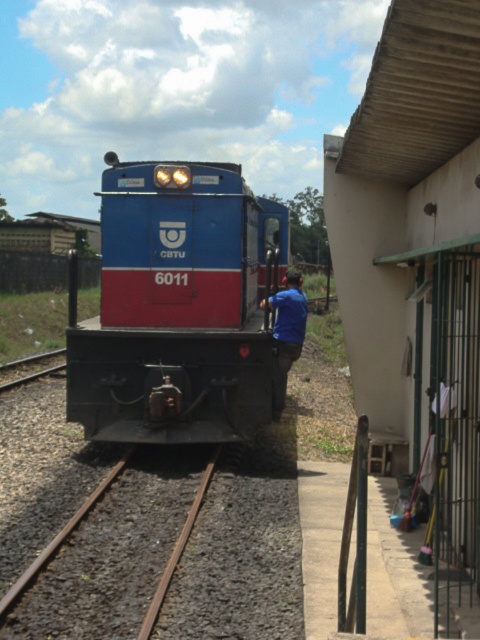
Question: Is blue glossy locomotive at center below brown rusted metal train track at lower left?

Choices:
 (A) no
 (B) yes

Answer: (A)

Question: Which point is closer to the camera taking this photo?

Choices:
 (A) (279, 314)
 (B) (365, 250)

Answer: (B)

Question: Which of these objects is positioned closest to the blue glossy locomotive at center?

Choices:
 (A) concrete wall at right
 (B) blue fabric shirt at center

Answer: (B)

Question: Is concrete wall at right closer to the viewer compared to blue fabric shirt at center?

Choices:
 (A) no
 (B) yes

Answer: (B)

Question: Is blue glossy locomotive at center wider than blue fabric shirt at center?

Choices:
 (A) no
 (B) yes

Answer: (B)

Question: Which object appears closest to the camera in this image?

Choices:
 (A) blue glossy locomotive at center
 (B) brown rusted metal train track at lower left
 (C) blue fabric shirt at center
 (D) concrete wall at right

Answer: (D)